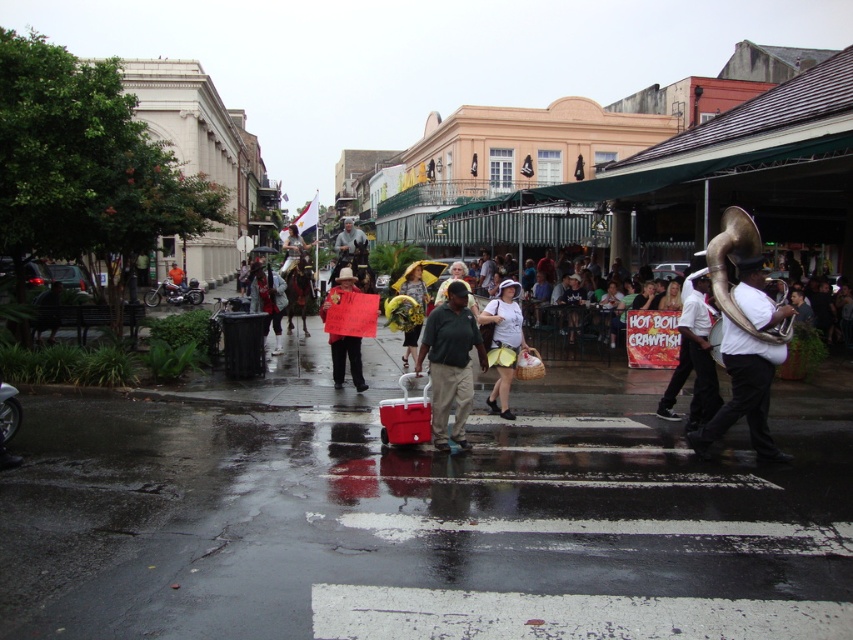
Consider the image. You are a delivery person trying to navigate through the street scene. You see a green cotton shirt at center and a red fabric bag at center. Which object takes up more space in the scene?

The red fabric bag at center takes up more space in the scene because the green cotton shirt at center occupies less space than it.

You are a photographer trying to capture both the white cotton dress at center and the shiny gold trumpet at right in a single frame. Which object should you focus on first to ensure both fit in the frame?

The white cotton dress at center is wider than the shiny gold trumpet at right, so focusing on the wider object first will help ensure both fit in the frame.

You are a photographer trying to capture both the white cotton dress at center and the yellow fabric umbrella at center in a single frame. Given their sizes, which object would you need to position closer to the camera to ensure both appear balanced in size in your photo?

The white cotton dress at center is smaller than the yellow fabric umbrella at center. To balance their sizes in the photo, you should position the white cotton dress at center closer to the camera so that it appears larger in the frame, matching the size of the yellow fabric umbrella at center.